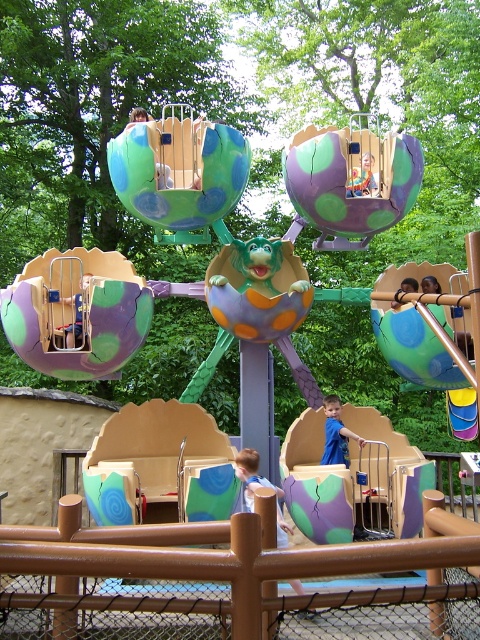
You are a parent trying to decide where to place your child for a photo. The light brown wooden bench at lower center and the blue fabric shirt at lower center are both in view. Which object would you choose if you want the subject to be larger in the photo?

The light brown wooden bench at lower center is bigger than the blue fabric shirt at lower center, so choosing the bench would make the subject appear larger in the photo.

You are a parent trying to locate your child who is wearing a blue fabric shirt at lower center. You see the matte purple slide at center. Which object is closer to you?

The matte purple slide at center is closer to you because it is in front of the blue fabric shirt at lower center.